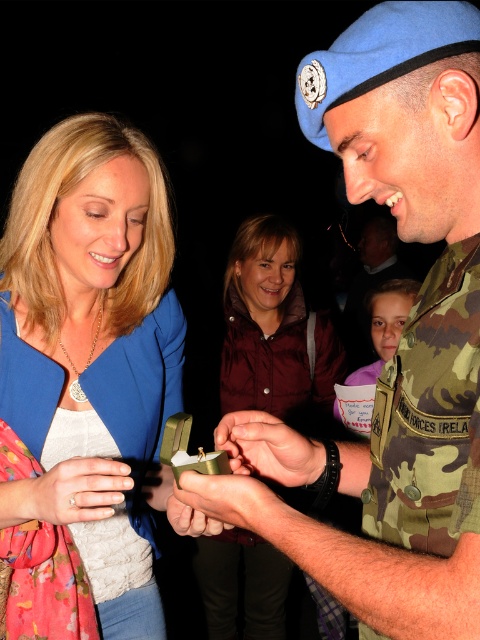
You are a photographer at the event. You need to adjust your camera focus to capture both the blue fabric jacket at upper left and the smooth skin hand at center. Which object should you focus on first to ensure proper depth of field?

The blue fabric jacket at upper left has a greater height compared to the smooth skin hand at center, so you should focus on the blue fabric jacket at upper left first to ensure proper depth of field.

You are a photographer at this event and need to capture a clear photo of both the blue fabric jacket at upper left and the metallic gold ring at center. Which object should you focus on first to ensure both are in focus?

You should focus on the blue fabric jacket at upper left first because it is closer to you than the metallic gold ring at center. By focusing on the closer object, the ring will also be in focus due to the depth of field.

You are a photographer at the event and need to adjust the lighting so that the camouflage uniform at center is fully visible while the camo fabric uniform at center is slightly blurred. Which uniform should you focus on and why?

You should focus on the camouflage uniform at center because it is in front of the camo fabric uniform at center, so focusing on it will keep it sharp while the background uniform becomes blurred.